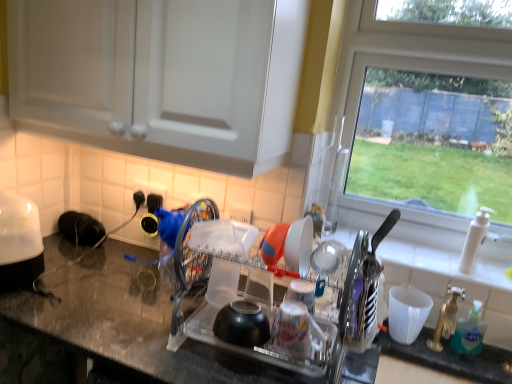
Identify the location of free location to the left of white plastic faucet at right. click(423, 262).